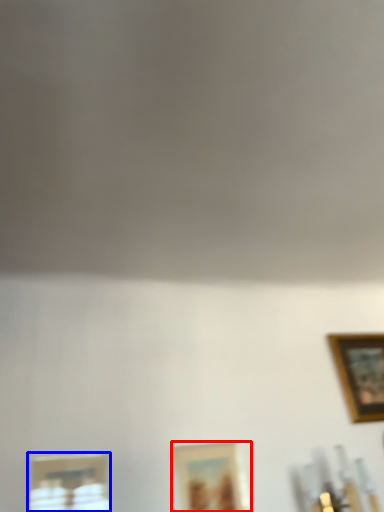
Question: Among these objects, which one is nearest to the camera, picture frame (highlighted by a red box) or picture frame (highlighted by a blue box)?

Choices:
 (A) picture frame
 (B) picture frame

Answer: (B)